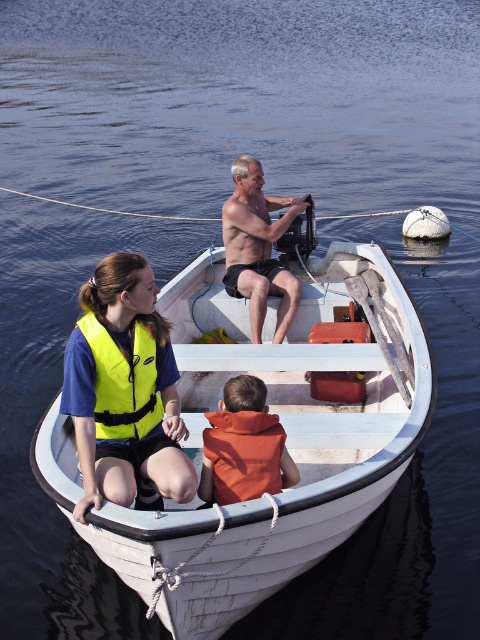
Image resolution: width=480 pixels, height=640 pixels. What are the coordinates of `white wood boat at center` in the screenshot? It's located at (287, 444).

Does white wood boat at center appear on the right side of orange life vest at center?

Yes, white wood boat at center is to the right of orange life vest at center.

Identify the location of white wood boat at center. This screenshot has height=640, width=480. coord(287,444).

Is yellow life vest at left below shiny skin at center?

Yes, yellow life vest at left is below shiny skin at center.

Between yellow life vest at left and shiny skin at center, which one appears on the right side from the viewer's perspective?

shiny skin at center

Find the location of `yellow life vest at left`. yellow life vest at left is located at coordinates (123, 388).

Who is more forward, (360, 486) or (276, 205)?

Point (360, 486)

Is white wood boat at center to the left of shiny skin at center from the viewer's perspective?

Incorrect, white wood boat at center is not on the left side of shiny skin at center.

Is point (365, 243) behind point (294, 211)?

Yes.

Identify the location of white wood boat at center. (287, 444).